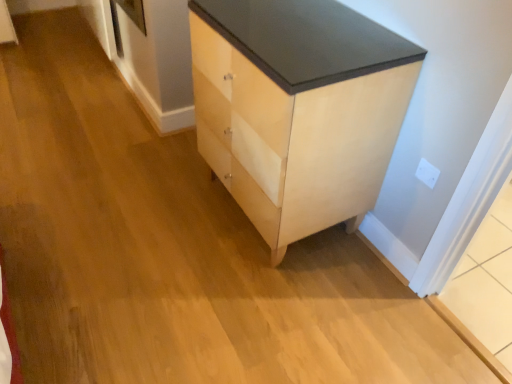
Question: Is white plastic electric outlet at upper right in front of or behind light wood/veneer chest of drawers at center in the image?

Choices:
 (A) front
 (B) behind

Answer: (B)

Question: From the image's perspective, is white plastic electric outlet at upper right located above or below light wood/veneer chest of drawers at center?

Choices:
 (A) above
 (B) below

Answer: (B)

Question: Is white plastic electric outlet at upper right inside the boundaries of light wood/veneer chest of drawers at center, or outside?

Choices:
 (A) outside
 (B) inside

Answer: (A)

Question: Considering the positions of light wood/veneer chest of drawers at center and white plastic electric outlet at upper right in the image, is light wood/veneer chest of drawers at center bigger or smaller than white plastic electric outlet at upper right?

Choices:
 (A) small
 (B) big

Answer: (B)

Question: From a real-world perspective, is light wood/veneer chest of drawers at center physically located above or below white plastic electric outlet at upper right?

Choices:
 (A) below
 (B) above

Answer: (A)

Question: From the image's perspective, is light wood/veneer chest of drawers at center positioned above or below white plastic electric outlet at upper right?

Choices:
 (A) below
 (B) above

Answer: (B)

Question: Is light wood/veneer chest of drawers at center to the left or to the right of white plastic electric outlet at upper right in the image?

Choices:
 (A) right
 (B) left

Answer: (B)